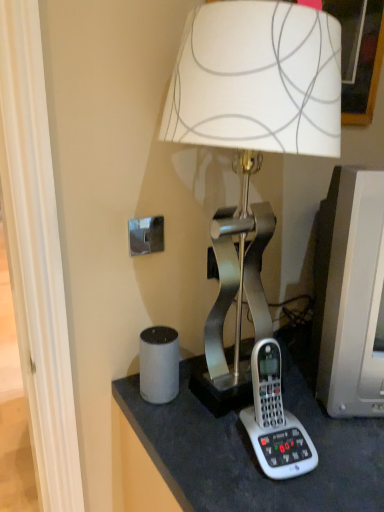
Question: In terms of height, does matte gray monitor at right look taller or shorter compared to white plastic corded phone at lower right?

Choices:
 (A) short
 (B) tall

Answer: (B)

Question: Considering the positions of matte gray monitor at right and white plastic corded phone at lower right in the image, is matte gray monitor at right wider or thinner than white plastic corded phone at lower right?

Choices:
 (A) wide
 (B) thin

Answer: (A)

Question: Which object is the closest to the matte gray monitor at right?

Choices:
 (A) metallic silver lamp at center
 (B) white plastic corded phone at lower right

Answer: (B)

Question: Estimate the real-world distances between objects in this image. Which object is farther from the metallic silver lamp at center?

Choices:
 (A) white plastic corded phone at lower right
 (B) matte gray monitor at right

Answer: (A)